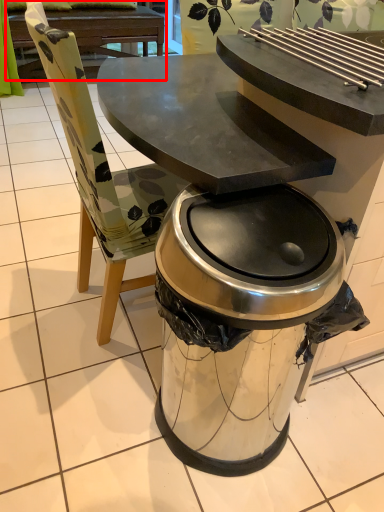
Question: Where is picnic table (annotated by the red box) located in relation to trash bin/can in the image?

Choices:
 (A) right
 (B) left

Answer: (B)